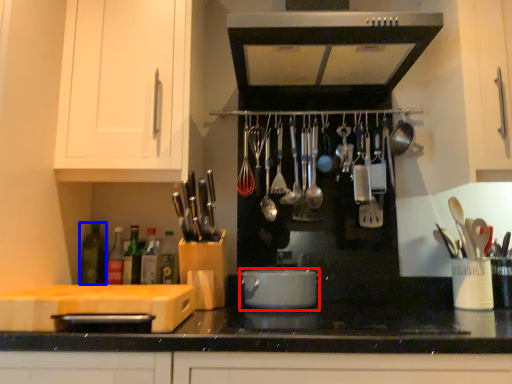
Question: Among these objects, which one is nearest to the camera, kitchen appliance (highlighted by a red box) or bottle (highlighted by a blue box)?

Choices:
 (A) kitchen appliance
 (B) bottle

Answer: (A)